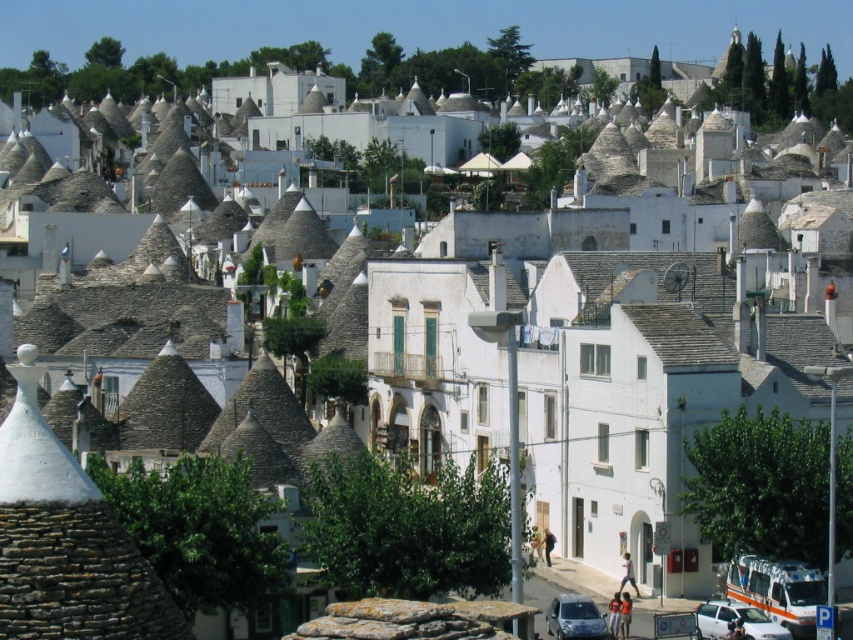
Question: Which of the following is the farthest from the observer?

Choices:
 (A) click(787, 630)
 (B) click(577, 602)

Answer: (B)

Question: Does metallic silver car at lower right have a larger size compared to silver metallic hatchback at lower center?

Choices:
 (A) no
 (B) yes

Answer: (A)

Question: Does metallic silver car at lower right appear on the right side of silver metallic hatchback at lower center?

Choices:
 (A) yes
 (B) no

Answer: (A)

Question: Is metallic silver car at lower right below silver metallic hatchback at lower center?

Choices:
 (A) no
 (B) yes

Answer: (B)

Question: Which point appears closest to the camera in this image?

Choices:
 (A) (701, 630)
 (B) (607, 628)

Answer: (A)